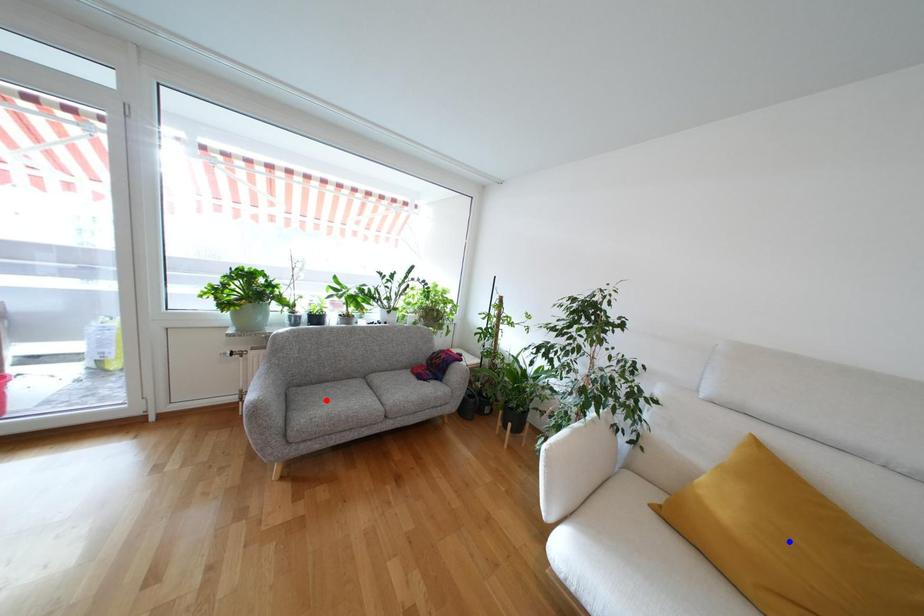
Question: In the image, two points are highlighted. Which point is nearer to the camera? Reply with the corresponding letter.

Choices:
 (A) blue point
 (B) red point

Answer: (A)